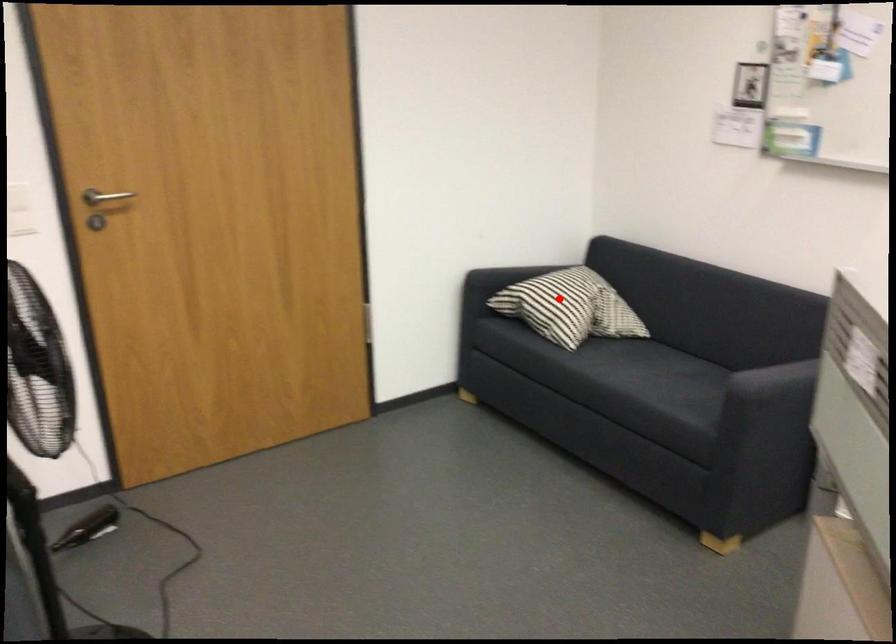
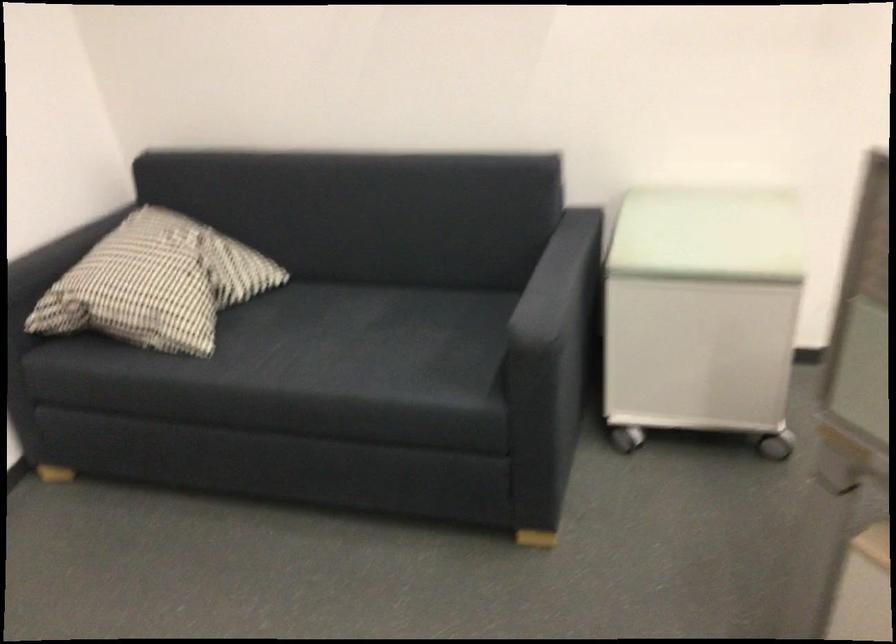
The point at the highlighted location is marked in the first image. Where is the corresponding point in the second image?

(156, 283)